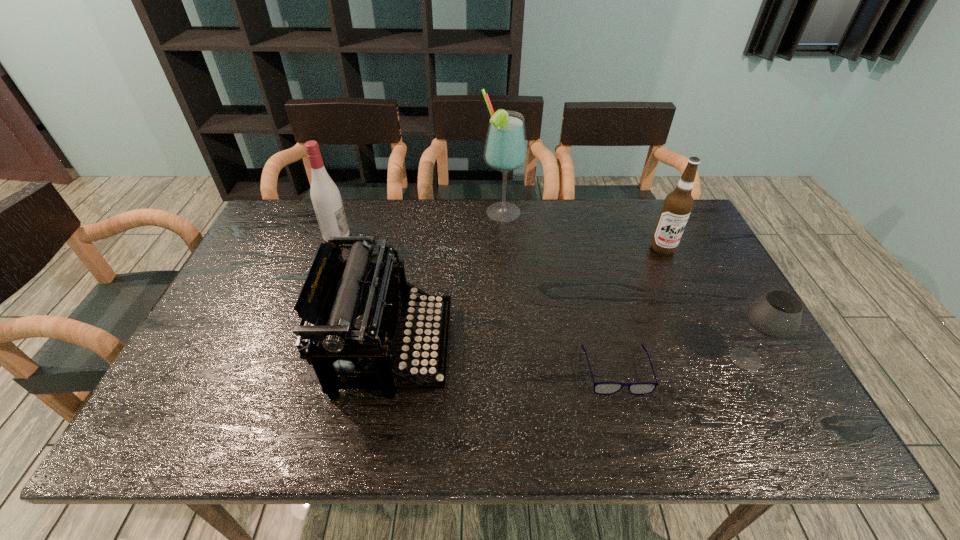
Locate an element on the screen. Image resolution: width=960 pixels, height=540 pixels. vacant area located on the label of the leftmost alcohol is located at coordinates (374, 235).

Image resolution: width=960 pixels, height=540 pixels. Identify the location of free spot located on the label of the rightmost alcohol. (687, 303).

Locate an element on the screen. free space located 0.290m on the typing side of the typewriter is located at coordinates (566, 347).

This screenshot has height=540, width=960. In order to click on vacant region located 0.330m on the left of the wineglass in this screenshot , I will do `click(588, 359)`.

Find the location of a particular element. free space located on the front-facing side of the shortest object is located at coordinates (629, 416).

Where is `object at the near edge`? Image resolution: width=960 pixels, height=540 pixels. object at the near edge is located at coordinates (354, 306).

Image resolution: width=960 pixels, height=540 pixels. I want to click on alcohol positioned at the right edge, so click(678, 204).

The image size is (960, 540). I want to click on wineglass located at the right edge, so click(x=777, y=314).

The height and width of the screenshot is (540, 960). I want to click on object that is at the far right corner, so click(678, 204).

The image size is (960, 540). Identify the location of vacant space at the far edge of the desktop. (493, 204).